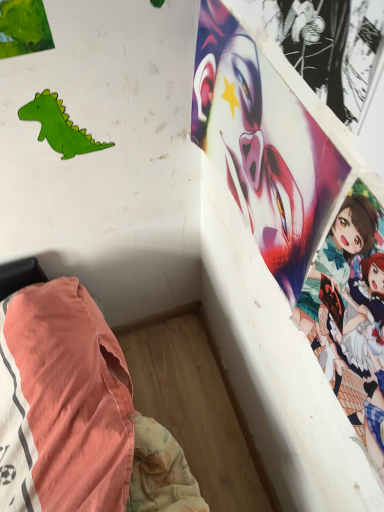
Question: Considering the positions of smooth glossy poster at upper right and green matte paper dinosaur at upper left in the image, is smooth glossy poster at upper right wider or thinner than green matte paper dinosaur at upper left?

Choices:
 (A) thin
 (B) wide

Answer: (B)

Question: In the image, is smooth glossy poster at upper right on the left side or the right side of green matte paper dinosaur at upper left?

Choices:
 (A) right
 (B) left

Answer: (A)

Question: From a real-world perspective, is smooth glossy poster at upper right positioned above or below green matte paper dinosaur at upper left?

Choices:
 (A) above
 (B) below

Answer: (A)

Question: Looking at their shapes, would you say green matte paper dinosaur at upper left is wider or thinner than smooth glossy poster at upper right?

Choices:
 (A) thin
 (B) wide

Answer: (A)

Question: Is green matte paper dinosaur at upper left spatially inside smooth glossy poster at upper right, or outside of it?

Choices:
 (A) inside
 (B) outside

Answer: (B)

Question: Is green matte paper dinosaur at upper left taller or shorter than smooth glossy poster at upper right?

Choices:
 (A) short
 (B) tall

Answer: (A)

Question: Considering their positions, is green matte paper dinosaur at upper left located in front of or behind smooth glossy poster at upper right?

Choices:
 (A) front
 (B) behind

Answer: (B)